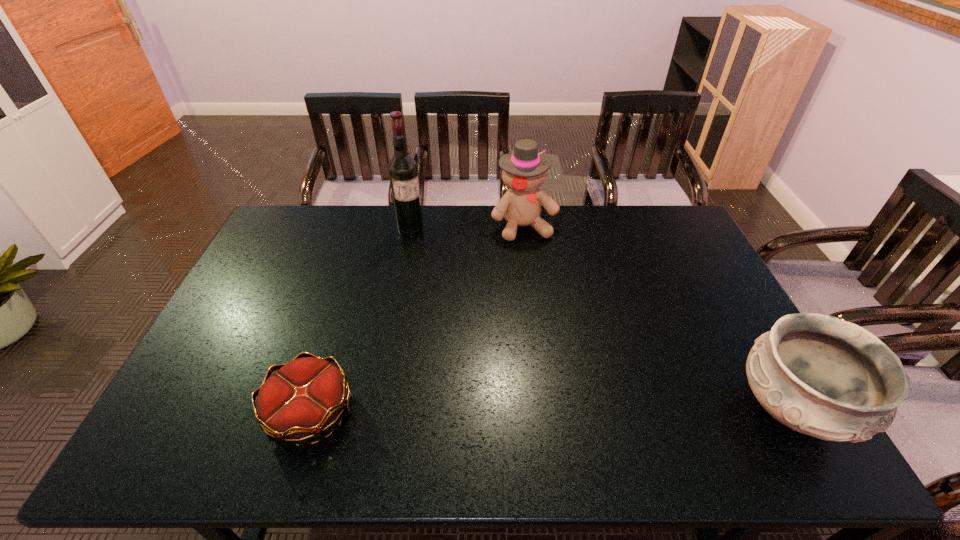
Find the location of a particular element. The width and height of the screenshot is (960, 540). vacant space that satisfies the following two spatial constraints: 1. on the back side of the second object from right to left; 2. on the right side of the leftmost object is located at coordinates (369, 226).

This screenshot has height=540, width=960. I want to click on vacant space that satisfies the following two spatial constraints: 1. on the back side of the rag_doll; 2. on the left side of the wine bottle, so click(412, 226).

What are the coordinates of `vacant area in the image that satisfies the following two spatial constraints: 1. on the front side of the pottery; 2. on the right side of the second object from left to right` in the screenshot? It's located at (377, 409).

Locate an element on the screen. The image size is (960, 540). free space that satisfies the following two spatial constraints: 1. on the back side of the third shortest object; 2. on the left side of the shortest object is located at coordinates (369, 226).